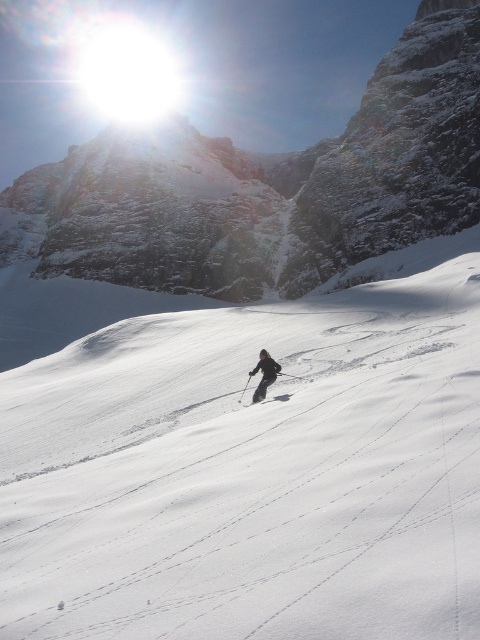
You are a drone operator trying to capture the skier in the center of the image. The drone is currently hovering above the white powder snow at center. To ensure the skier is centered in your shot, should you move the drone to the left or right? Please provide coordinates for the drone to move to.

The white powder snow at center is located at coordinates (252, 472). To center the skier in the shot, move the drone to the coordinates corresponding to the skier, which are not provided. However, since the snow is at (252, 472), adjusting slightly left or right depends on the skier position relative to these coordinates. Without exact skier coordinates, precise movement can not be determined.

You are a photographer planning to capture a closeup shot of the white powder snow at center and the white matte ski at center. Based on their heights, which object should you focus on first to ensure proper depth of field?

The white powder snow at center has a greater height compared to the white matte ski at center. Therefore, you should focus on the white powder snow at center first to ensure proper depth of field.

You are a photographer trying to capture the skier in the snow. You have a camera with a zoom lens. Which object, the white powder snow at center or the white matte ski at center, will appear larger in your photo if you zoom in equally on both?

The white powder snow at center will appear larger in the photo because it is bigger than the white matte ski at center according to the description.